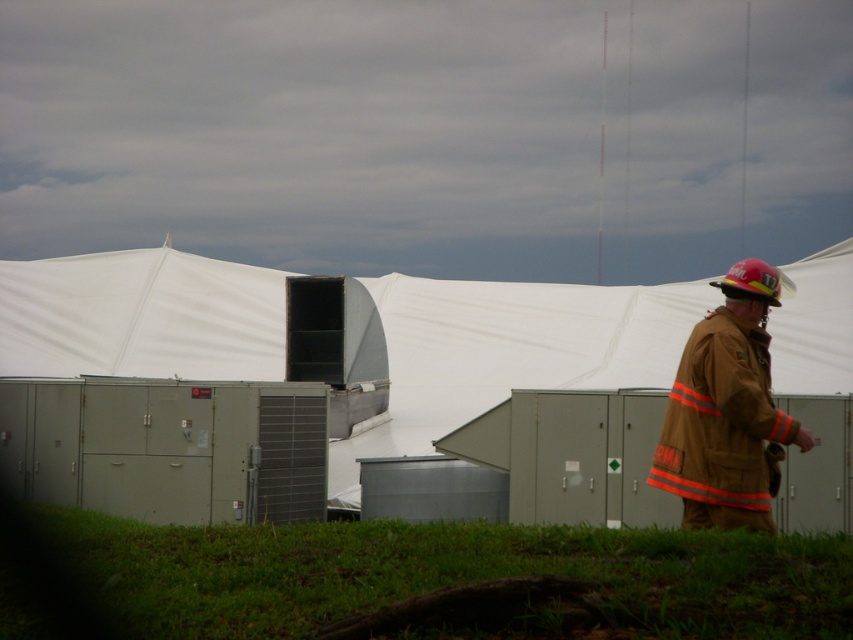
You are a drone operator trying to fly a drone with a 2 meter wingspan through the opening of the white fabric tent at center. Considering the brown fireman uniform at right is standing 3 meters away from the tent, can the drone safely pass through the opening without hitting the tent or the fireman?

The white fabric tent at center might be wider than brown fireman uniform at right, but the description does not provide exact measurements of the tent opening or the distance between the fireman and the tent. Without knowing the width of the opening or the fireman s position relative to it, it is impossible to determine if the drone can safely pass.

You are a firefighter standing in the grassy area. You need to quickly reach the tent with the visible opening. The tent is 10 meters away from you. Can you safely step on the green grass at lower center to move towards the tent?

The green grass at lower center is 4.62 meters away from viewer. Since the tent is 10 meters away, stepping on the green grass at lower center is possible as it is within the distance needed to reach the tent.

You are a drone operator tasked with delivering a small package to the white fabric tent at center. Your drone can only hover 10 meters above the ground. Considering the height of the green grass at lower center, will your drone be able to safely navigate to the tent without hitting any obstacles?

The distance between the white fabric tent at center and the green grass at lower center is 12.19 meters. Since the drone can hover 10 meters above the ground, it would not have enough vertical clearance to safely navigate over the green grass at lower center, which is part of the terrain. Therefore, the drone might hit obstacles during the flight.